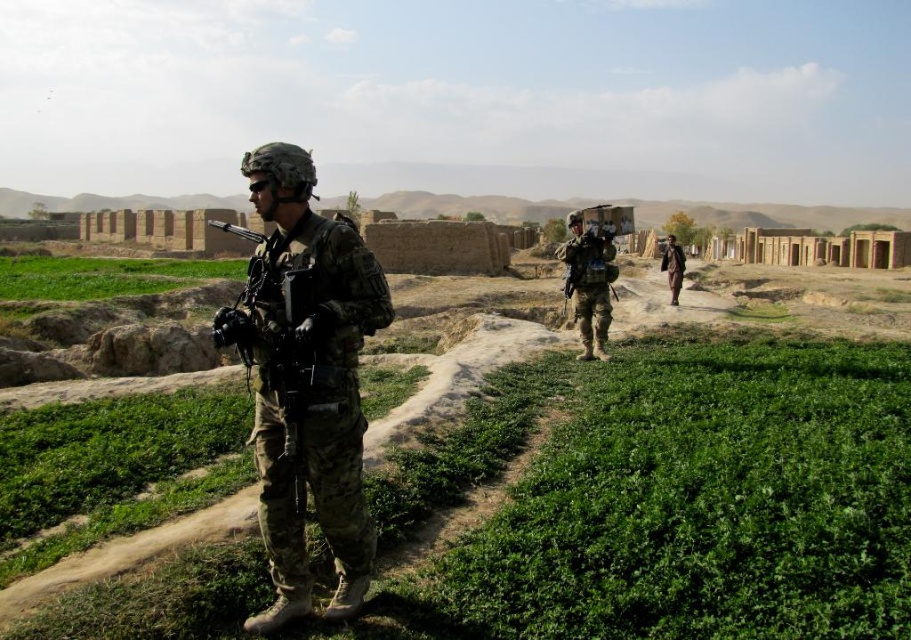
You are a photographer trying to capture a clear shot of both the camouflage uniform at center and the matte black helmet at upper center. Based on their positions, which object should you focus on first to ensure both are in frame?

The camouflage uniform at center is to the left of matte black helmet at upper center, so you should focus on the matte black helmet at upper center first to ensure both are in frame.